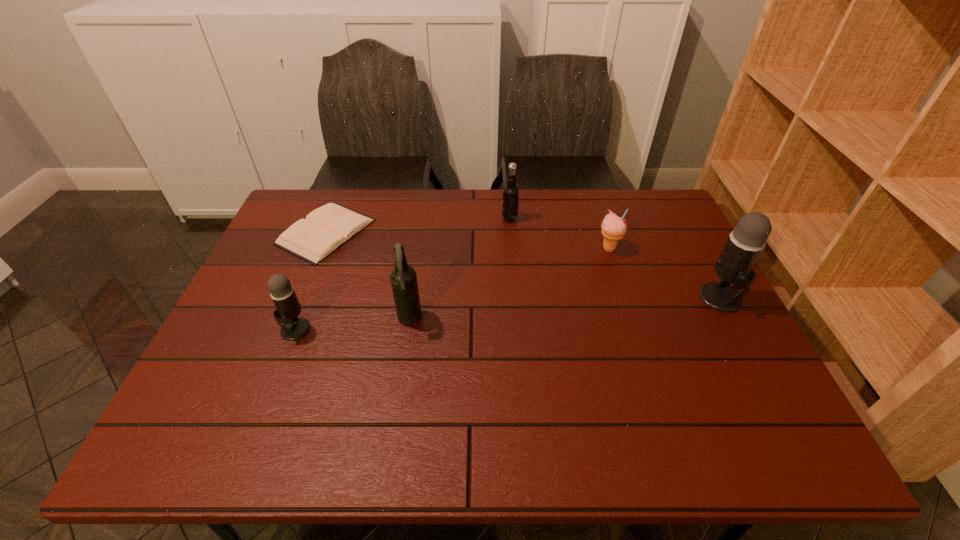
This screenshot has height=540, width=960. What are the coordinates of `the shorter microphone` in the screenshot? It's located at (288, 308).

The height and width of the screenshot is (540, 960). I want to click on the nearer microphone, so click(288, 308).

The width and height of the screenshot is (960, 540). I want to click on the taller microphone, so click(x=745, y=243).

Locate an element on the screen. The width and height of the screenshot is (960, 540). the right microphone is located at coordinates (745, 243).

At what (x,y) coordinates should I click in order to perform the action: click on hardback book. Please return your answer as a coordinate pair (x, y). Looking at the image, I should click on coord(327,228).

What are the coordinates of `the fifth tallest object` in the screenshot? It's located at (614, 228).

Find the location of `icecream`. icecream is located at coordinates (614, 228).

This screenshot has width=960, height=540. What are the coordinates of `the third object from right to left` in the screenshot? It's located at (511, 192).

Locate an element on the screen. the fourth object from right to left is located at coordinates (403, 278).

You are a GUI agent. You are given a task and a screenshot of the screen. Output one action in this format:
    pyautogui.click(x=<x>, y=<y>)
    Task: Click on the free spot located on the right of the nearer microphone
    This screenshot has width=960, height=540.
    Given the screenshot: What is the action you would take?
    pyautogui.click(x=415, y=329)